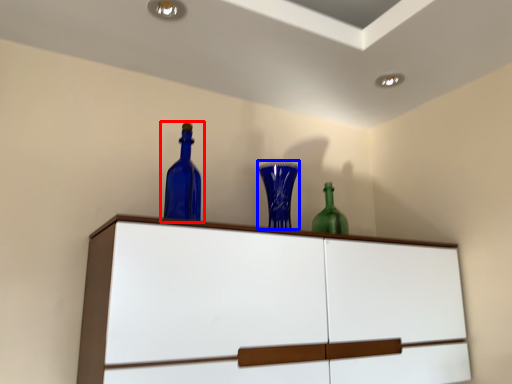
Question: Which object appears closest to the camera in this image, bottle (highlighted by a red box) or glass vase (highlighted by a blue box)?

Choices:
 (A) bottle
 (B) glass vase

Answer: (A)